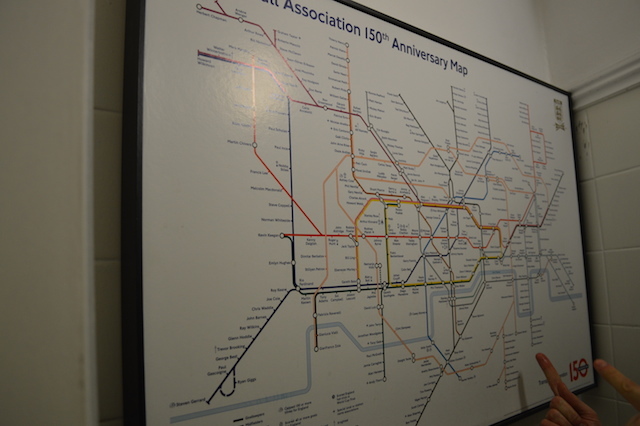
Where is `tiled wall`? The height and width of the screenshot is (426, 640). tiled wall is located at coordinates (618, 222), (107, 219).